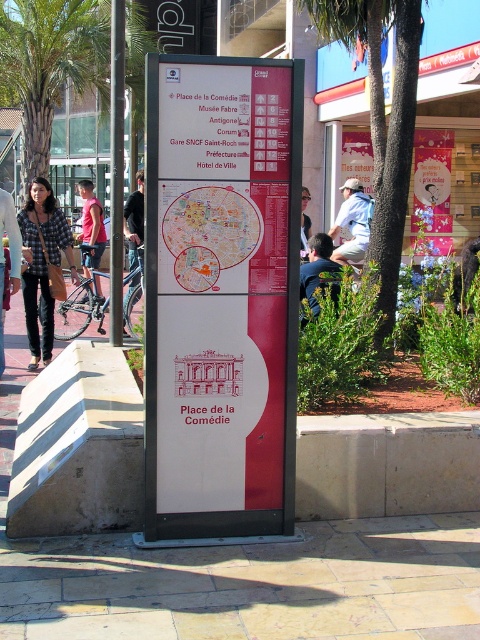
You are trying to decide which shirt to wear for a casual day out. The checkered fabric shirt at left and the white cotton shirt at center are both options. Based on their widths, which one is narrower?

The checkered fabric shirt at left is narrower than the white cotton shirt at center.